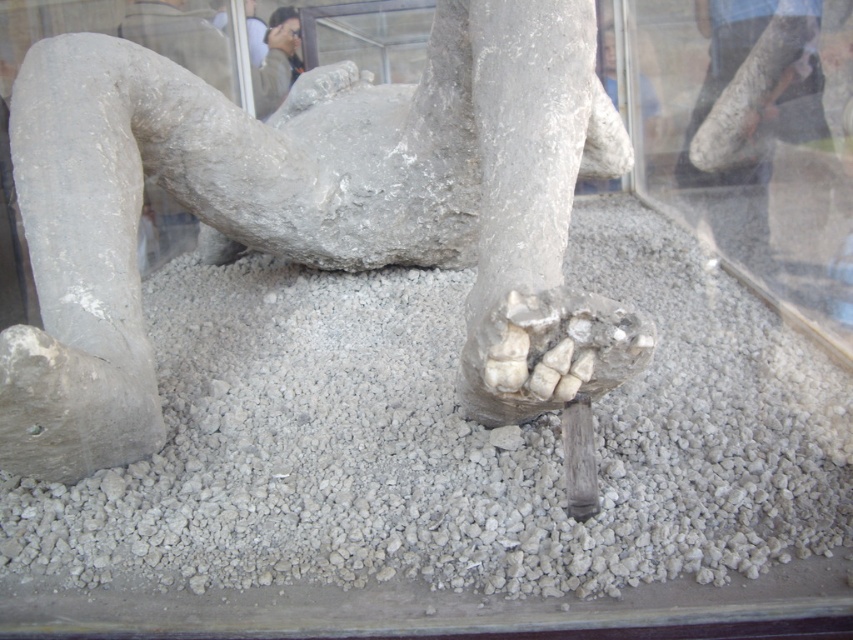
Question: Can you confirm if gray gravel at center is bigger than gray stone statue at center?

Choices:
 (A) no
 (B) yes

Answer: (B)

Question: Which of the following is the farthest from the observer?

Choices:
 (A) gray stone statue at center
 (B) gray gravel at center

Answer: (B)

Question: Is the position of gray gravel at center less distant than that of gray stone statue at center?

Choices:
 (A) no
 (B) yes

Answer: (A)

Question: Can you confirm if gray gravel at center is positioned to the right of gray stone statue at center?

Choices:
 (A) no
 (B) yes

Answer: (B)

Question: Among these objects, which one is nearest to the camera?

Choices:
 (A) gray gravel at center
 (B) gray stone statue at center

Answer: (B)

Question: Which point is closer to the camera?

Choices:
 (A) gray stone statue at center
 (B) gray gravel at center

Answer: (A)